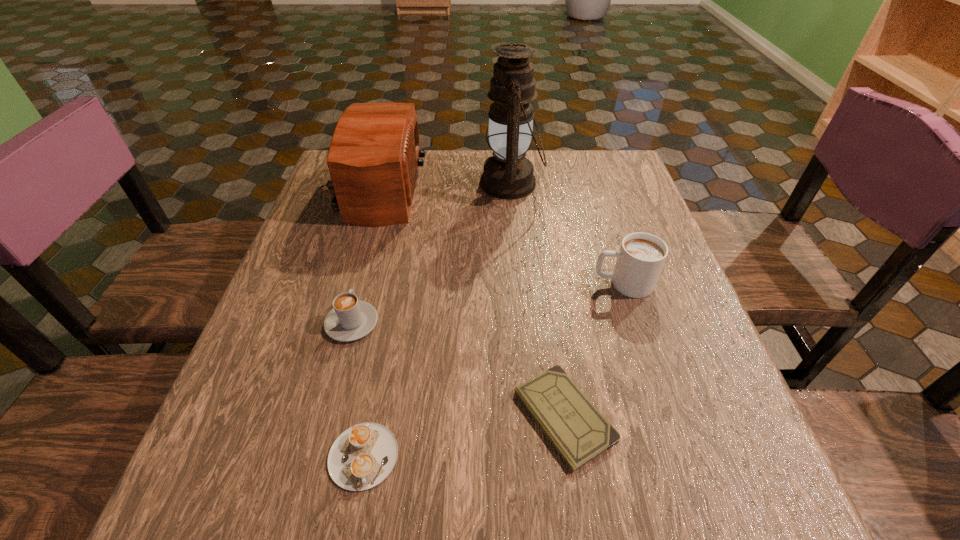
You are a GUI agent. You are given a task and a screenshot of the screen. Output one action in this format:
    pyautogui.click(x=<x>, y=<y>)
    Task: Click on the vacant space at the right edge of the desktop
    The height and width of the screenshot is (540, 960).
    Given the screenshot: What is the action you would take?
    pyautogui.click(x=672, y=267)

Locate an element on the screen. The image size is (960, 540). vacant space at the far right corner is located at coordinates (593, 176).

At what (x,y) coordinates should I click in order to perform the action: click on vacant space that's between the nearest cappuccino and the checkbook. Please return your answer as a coordinate pair (x, y). Looking at the image, I should click on (464, 436).

I want to click on vacant point located between the checkbook and the radio receiver, so click(x=468, y=303).

Locate an element on the screen. unoccupied position between the tallest object and the second tallest object is located at coordinates (443, 186).

Where is `unoccupied area between the radio receiver and the checkbook`? unoccupied area between the radio receiver and the checkbook is located at coordinates (468, 303).

At what (x,y) coordinates should I click in order to perform the action: click on free spot between the shortest object and the second nearest cappuccino. Please return your answer as a coordinate pair (x, y). Looking at the image, I should click on (458, 370).

Locate an element on the screen. Image resolution: width=960 pixels, height=540 pixels. free space between the checkbook and the tallest object is located at coordinates (538, 300).

Where is `free spot between the oil lamp and the second shortest cappuccino`? The image size is (960, 540). free spot between the oil lamp and the second shortest cappuccino is located at coordinates (431, 253).

The image size is (960, 540). Identify the location of free point between the third nearest object and the fifth shortest object. (363, 256).